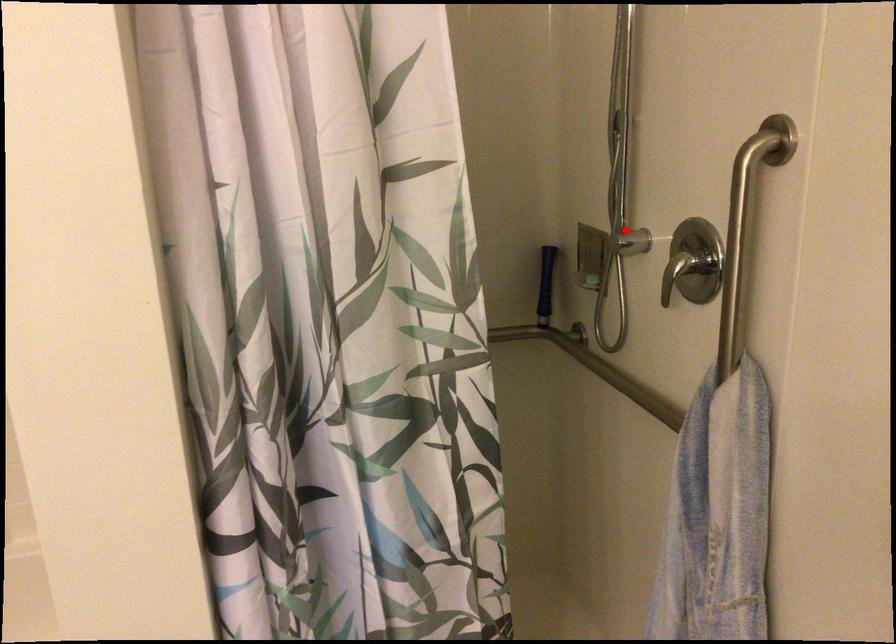
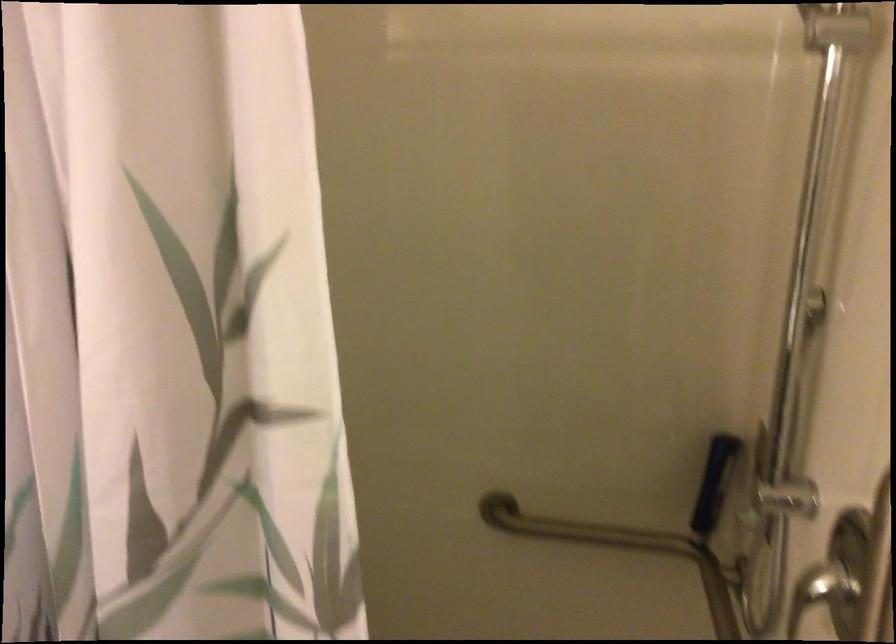
Question: I am providing you with two images of the same scene from different viewpoints. In image1, a red point is highlighted. Considering the same 3D point in image2, which of the following is correct?

Choices:
 (A) It is closer
 (B) It is farther

Answer: (A)